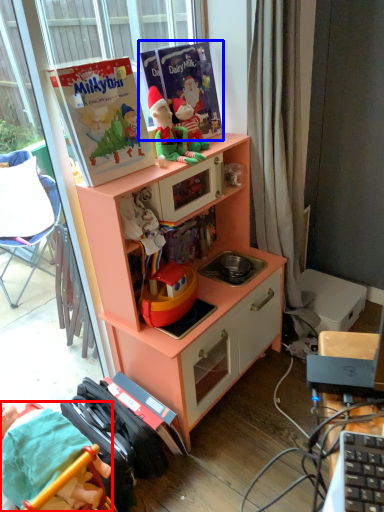
Question: Which object is closer to the camera taking this photo, person (highlighted by a red box) or paperback book (highlighted by a blue box)?

Choices:
 (A) person
 (B) paperback book

Answer: (A)